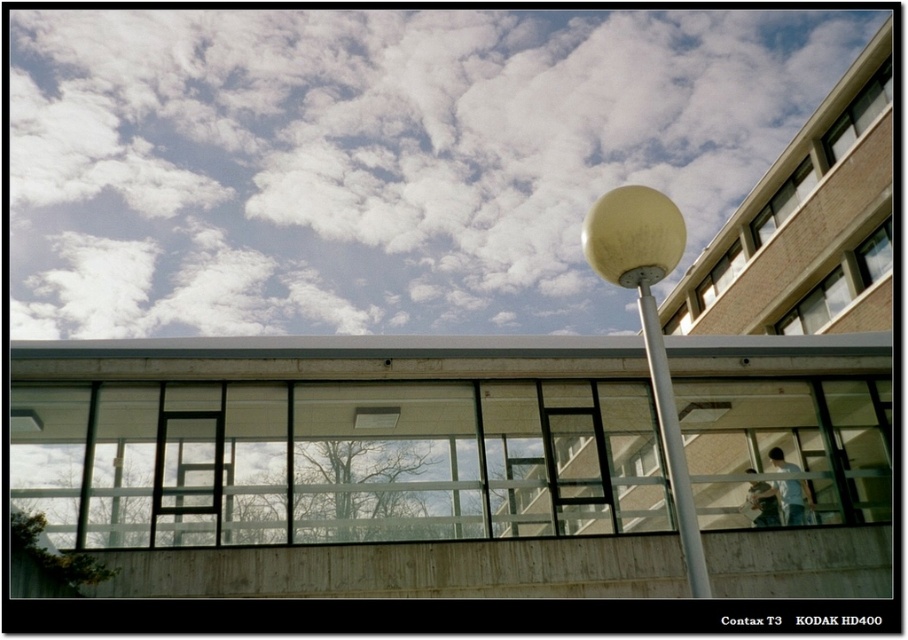
You are standing in front of the building and notice both the metallic silver pole at center and the wooden ladder at center. Which object is closer to you?

The metallic silver pole at center is closer to you because it is in front of the wooden ladder at center.

You are an architect designing a new plaza and want to install two types of poles in the central area. The scene shows a metallic silver pole at center and a white glossy pole at center. Which pole is taller?

The metallic silver pole at center is much taller than the white glossy pole at center, so the metallic silver pole is taller.